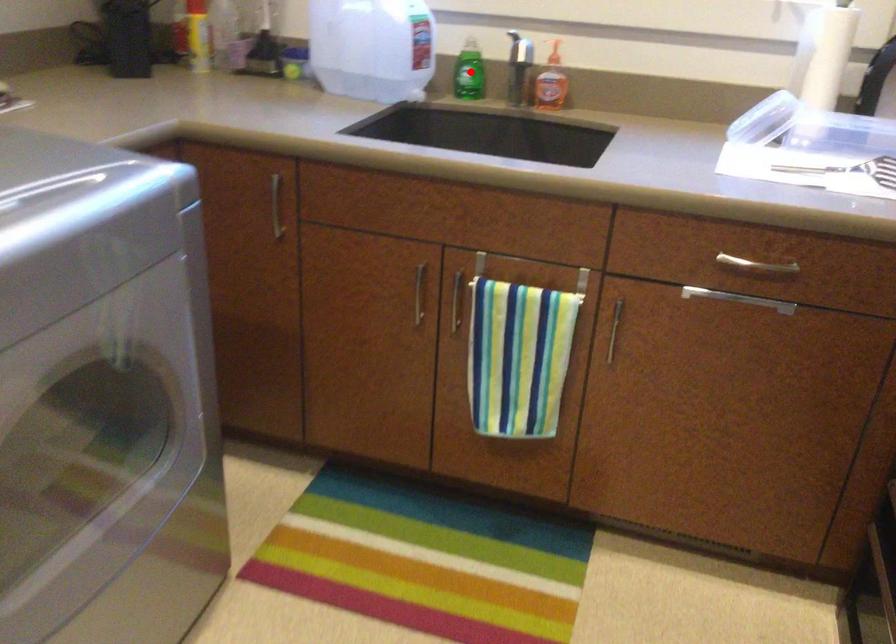
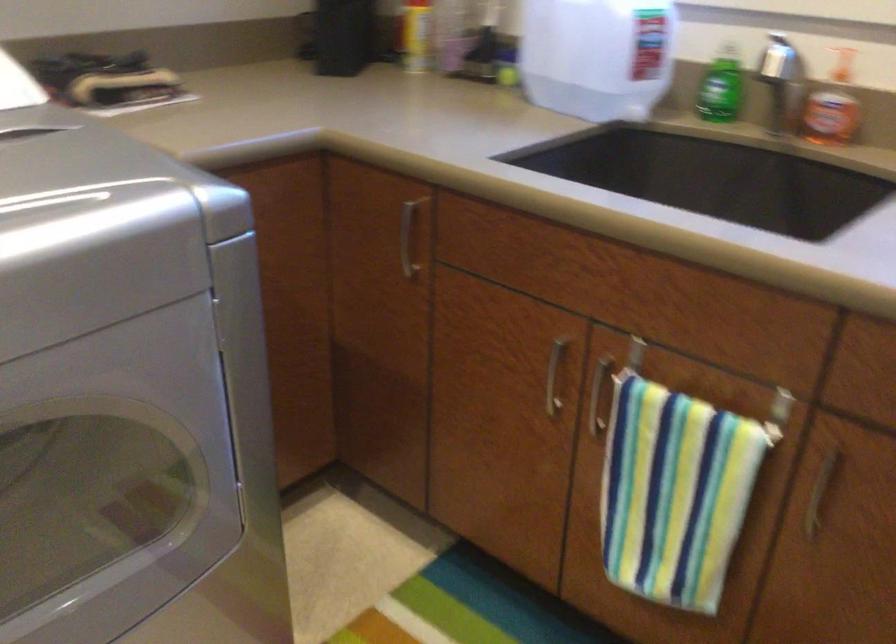
Where in the second image is the point corresponding to the highlighted location from the first image?

(721, 88)